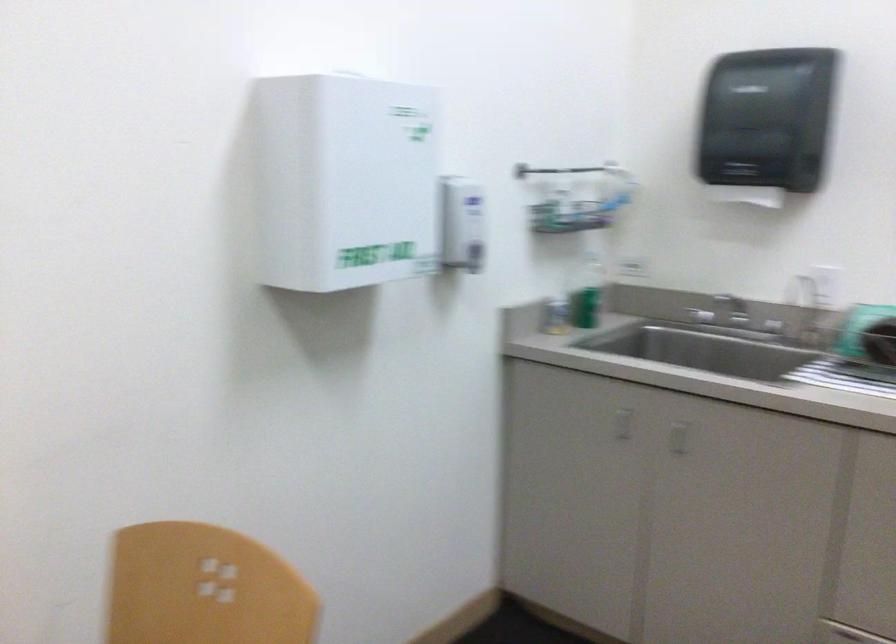
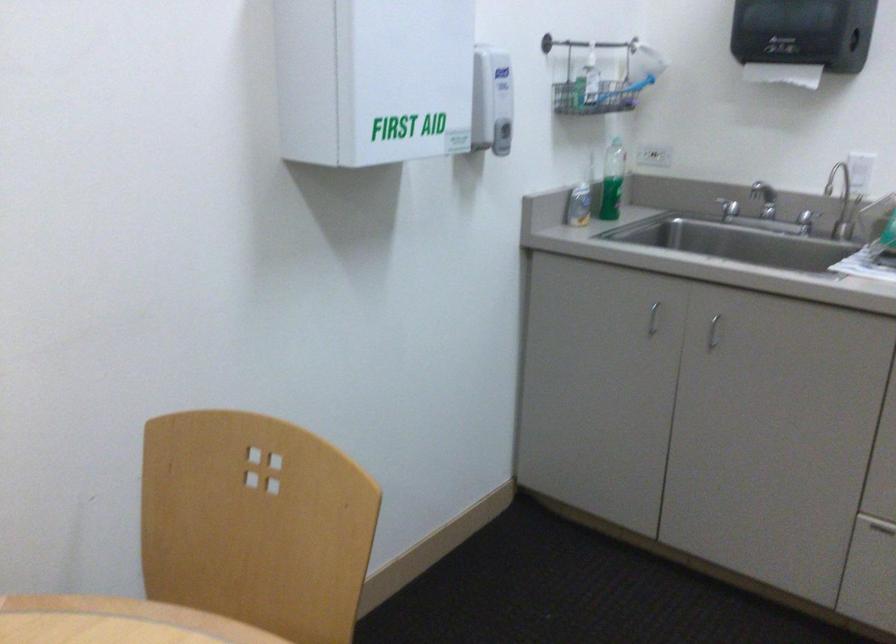
Where in the second image is the point corresponding to (x=583, y=295) from the first image?

(613, 181)